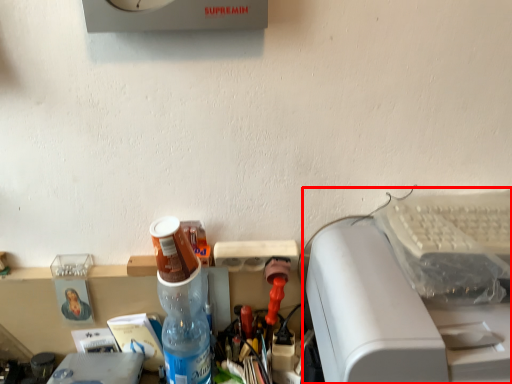
Question: From the image's perspective, considering the relative positions of printer (annotated by the red box) and bottle in the image provided, where is printer (annotated by the red box) located with respect to the staircase?

Choices:
 (A) below
 (B) above

Answer: (A)